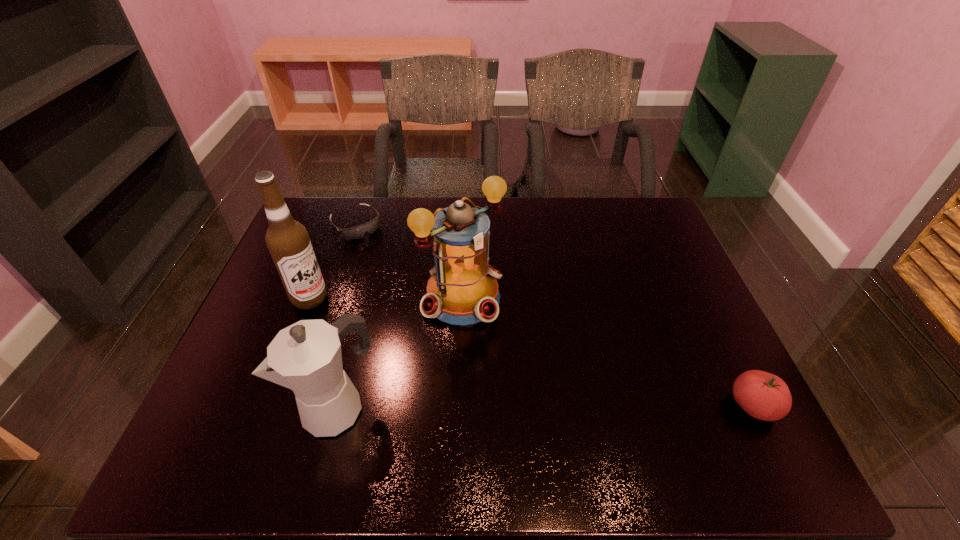
Locate an element on the screen. The image size is (960, 540). the third tallest object is located at coordinates (306, 357).

At what (x,y) coordinates should I click in order to perform the action: click on the fourth tallest object. Please return your answer as a coordinate pair (x, y). This screenshot has width=960, height=540. Looking at the image, I should click on (764, 396).

Find the location of `tomato`. tomato is located at coordinates (764, 396).

Image resolution: width=960 pixels, height=540 pixels. Identify the location of alcohol. (287, 240).

The height and width of the screenshot is (540, 960). What are the coordinates of `the fourth shortest object` in the screenshot? It's located at (463, 289).

You are a GUI agent. You are given a task and a screenshot of the screen. Output one action in this format:
    pyautogui.click(x=<x>, y=<y>)
    Task: Click on the lantern
    This screenshot has height=540, width=960.
    Given the screenshot: What is the action you would take?
    pyautogui.click(x=463, y=289)

The image size is (960, 540). What are the coordinates of `the farthest object` in the screenshot? It's located at (357, 232).

At what (x,y) coordinates should I click in order to perform the action: click on goggles. Please return your answer as a coordinate pair (x, y). Looking at the image, I should click on (357, 232).

Identify the location of free region located 0.210m on the back of the third shortest object. click(363, 310).

I want to click on free location located on the back of the tomato, so pyautogui.click(x=727, y=352).